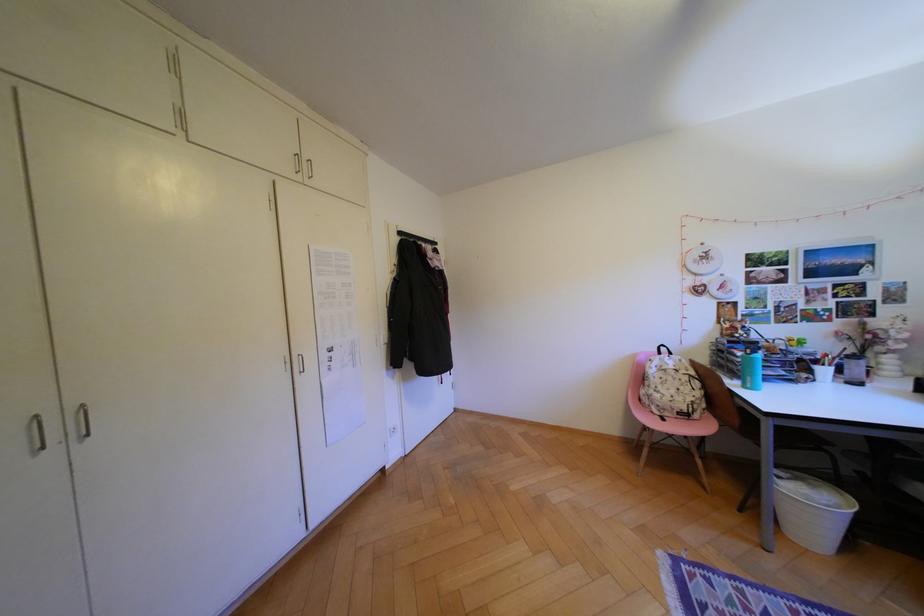
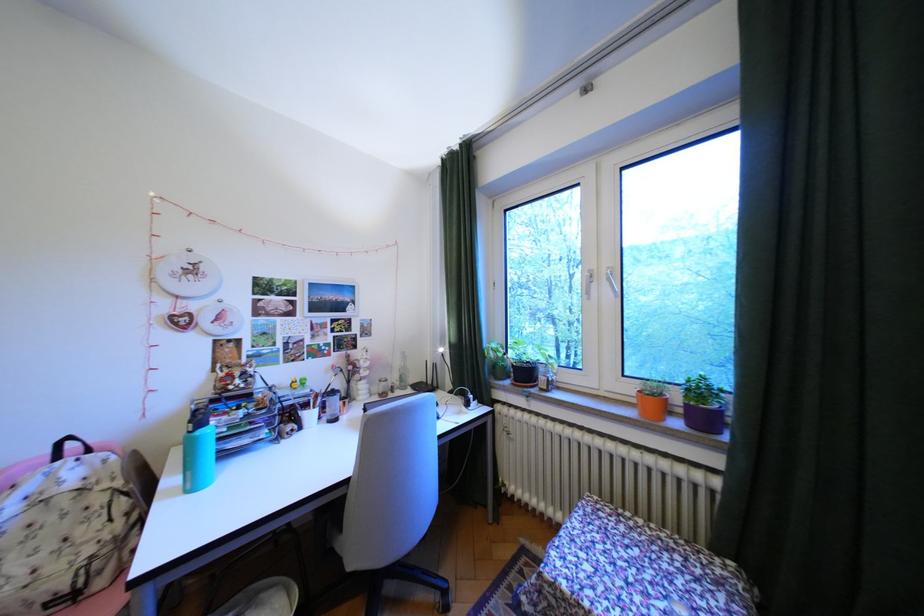
The point at [682,379] is marked in the first image. Where is the corresponding point in the second image?

(65, 519)